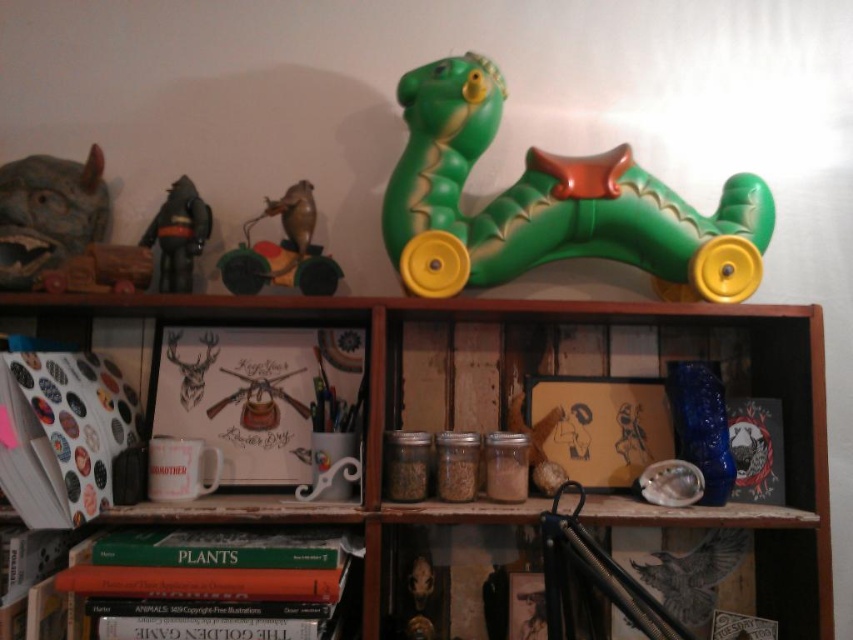
You are organizing a shelf and need to place a new item between the white matte book at left and the green rubber toy at upper center. Where should you place it to ensure it fits between them?

Place the new item between the white matte book at left and the green rubber toy at upper center, as the white matte book at left is already positioned to the left of the green rubber toy at upper center.

You are organizing a shelf and want to place a new item between the white matte book at left and the green rubber toy at upper center. Based on their current positions, where should you place the new item to ensure it is between them?

The white matte book at left is below the green rubber toy at upper center, so placing the new item between them would require positioning it above the white matte book at left and below the green rubber toy at upper center.

What is located at the coordinates point [505,401] on the wooden shelf?

The wooden bookcase at upper center is located at point [505,401].